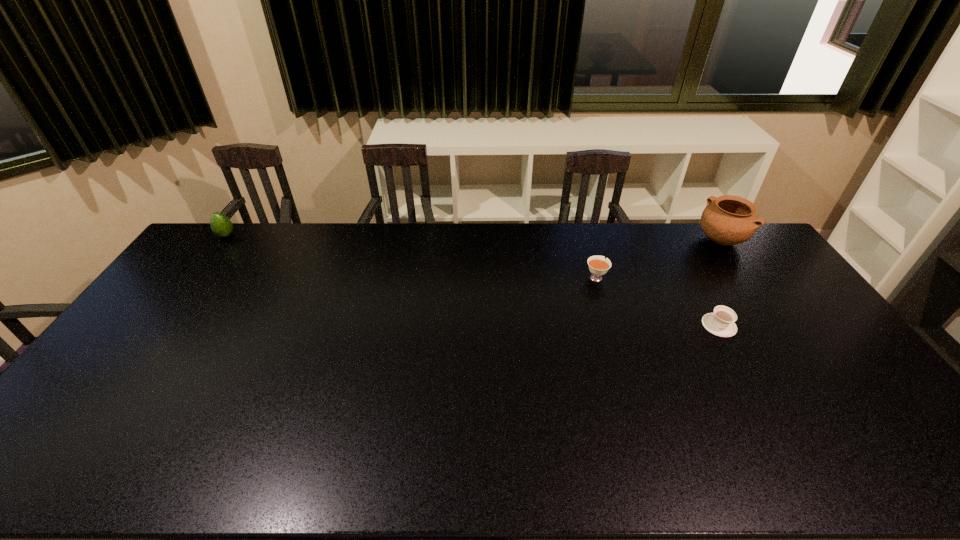
Locate an element on the screen. This screenshot has width=960, height=540. object that is at the far left corner is located at coordinates (221, 225).

Identify the location of object situated at the far right corner. The height and width of the screenshot is (540, 960). (727, 220).

Locate an element on the screen. Image resolution: width=960 pixels, height=540 pixels. free region at the far edge of the desktop is located at coordinates (655, 253).

Find the location of `vacant region at the near edge`. vacant region at the near edge is located at coordinates (449, 449).

In the image, there is a desktop. Where is `vacant space at the right edge`? This screenshot has height=540, width=960. vacant space at the right edge is located at coordinates (832, 381).

This screenshot has height=540, width=960. In the image, there is a desktop. Find the location of `free space at the far left corner`. free space at the far left corner is located at coordinates (206, 239).

The image size is (960, 540). I want to click on free spot between the leftmost object and the pottery, so click(x=473, y=238).

You are a GUI agent. You are given a task and a screenshot of the screen. Output one action in this format:
    pyautogui.click(x=<x>, y=<y>)
    Task: Click on the free space that is in between the tallest object and the shorter teacup
    
    Given the screenshot: What is the action you would take?
    pyautogui.click(x=719, y=282)

Image resolution: width=960 pixels, height=540 pixels. Identify the location of free space that is in between the third tallest object and the shorter teacup. (658, 301).

The image size is (960, 540). What are the coordinates of `free spot between the nearer teacup and the pottery` in the screenshot? It's located at (719, 282).